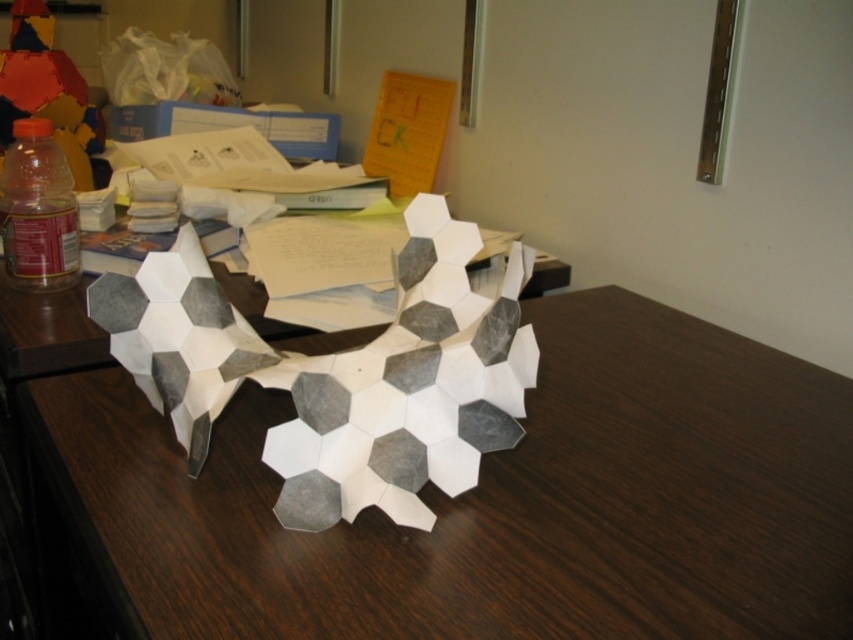
You are organizing a workspace and need to place a new item on the white wood table at center. Given its current position at coordinates 0.787, 0.558, is there sufficient space available on the table to accommodate the new item?

The white wood table at center is located at point (474, 502). However, the provided information does not specify the dimensions of the table or the size of the new item. Without this data, it is impossible to determine if there is enough space. Please provide more details about the table size and the item dimensions for an accurate assessment.

You are trying to place a small statue that requires a stable surface. The statue is 10 cm tall. Based on the scene, which object between the white wood table at center and the translucent plastic bottle at left would be a better choice for placing the statue?

The white wood table at center is much taller than the translucent plastic bottle at left, so placing the statue on the white wood table at center would provide a more stable and level surface due to its height and sturdiness compared to the bottle.

You are organizing items on the desk and need to place the translucent plastic bottle at left next to the white wood table at center. Will the bottle fit next to the table without overlapping?

The white wood table at center is wider than the translucent plastic bottle at left, so there should be enough space to place the bottle next to the table without overlapping.